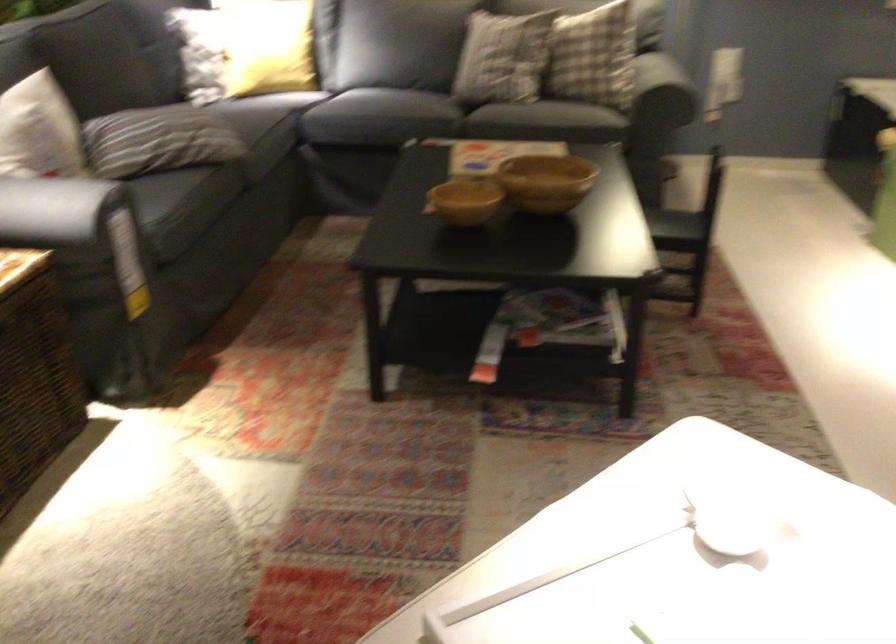
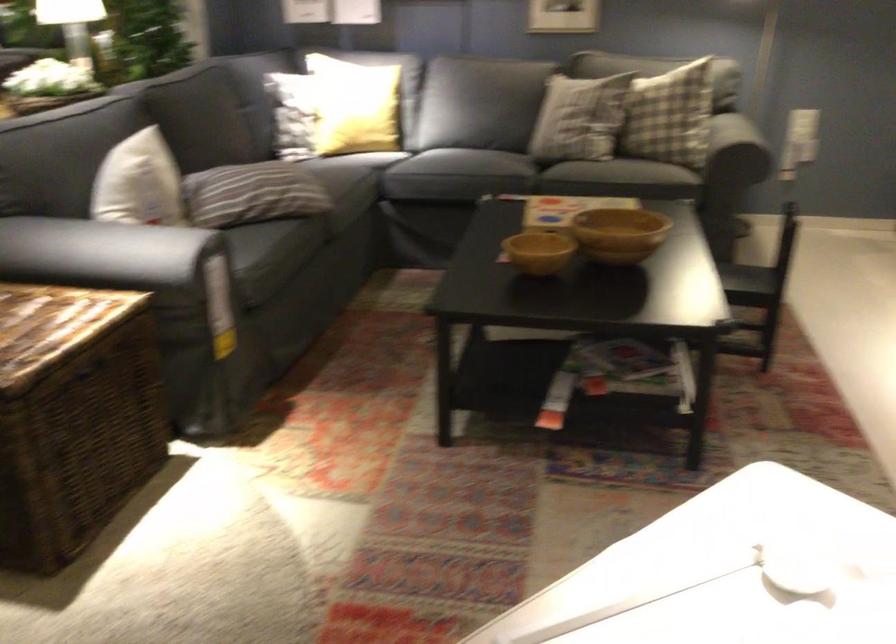
Locate, in the second image, the point that corresponds to (x=306, y=91) in the first image.

(386, 149)